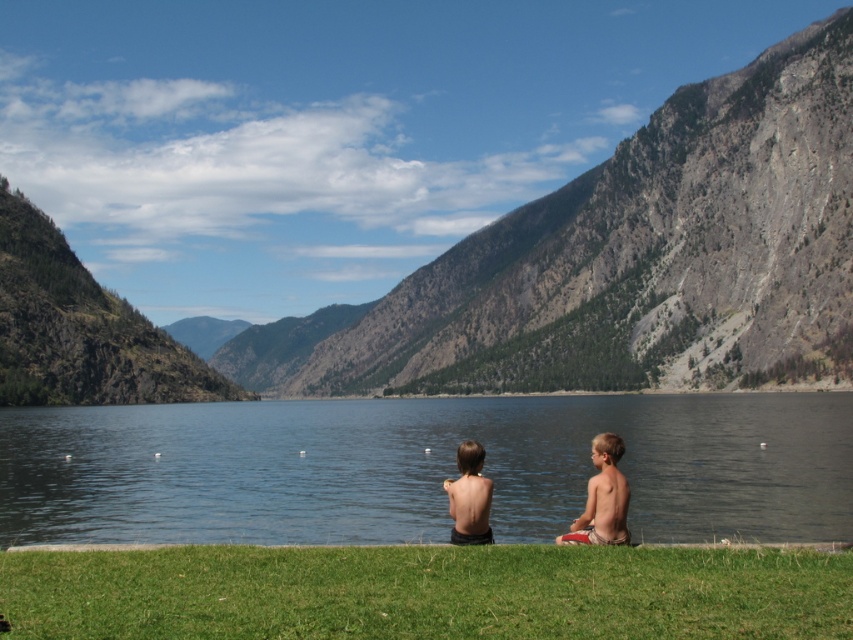
Question: Does blonde hair boy at lower right lie behind smooth skin child at center?

Choices:
 (A) yes
 (B) no

Answer: (B)

Question: From the image, what is the correct spatial relationship of green grass at lower center in relation to light brown skin at center?

Choices:
 (A) right
 (B) left

Answer: (B)

Question: Is green rocky mountain at center to the left of blonde hair boy at lower right from the viewer's perspective?

Choices:
 (A) yes
 (B) no

Answer: (A)

Question: Which point is closer to the camera?

Choices:
 (A) blonde hair boy at lower right
 (B) smooth skin child at center

Answer: (A)

Question: Which object is closer to the camera taking this photo?

Choices:
 (A) blonde hair boy at lower right
 (B) green grass at lower center
 (C) smooth skin child at center

Answer: (B)

Question: Estimate the real-world distances between objects in this image. Which object is farther from the light brown skin at center?

Choices:
 (A) smooth skin child at center
 (B) clear water at center

Answer: (B)